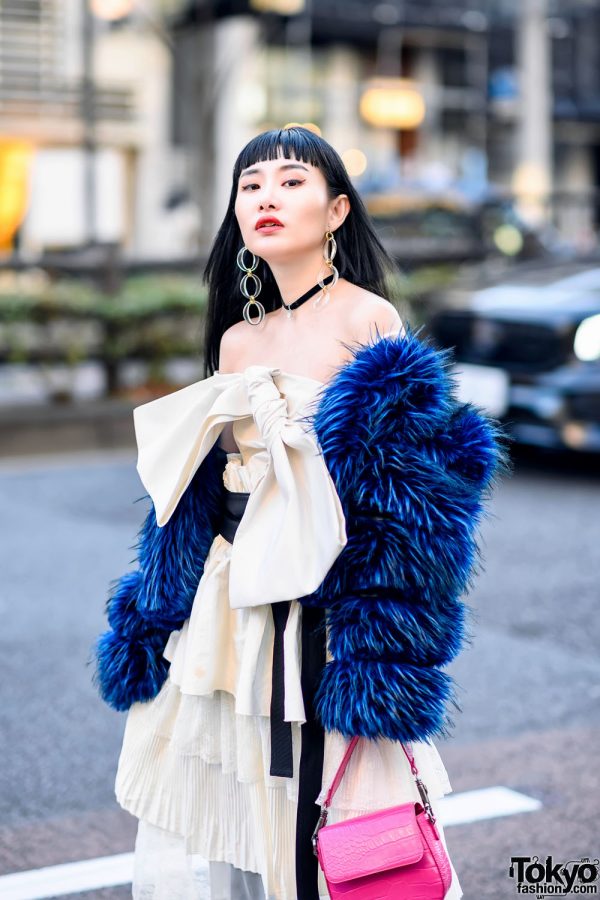
Find the location of a particular element. The height and width of the screenshot is (900, 600). green plants is located at coordinates (150, 295), (416, 284).